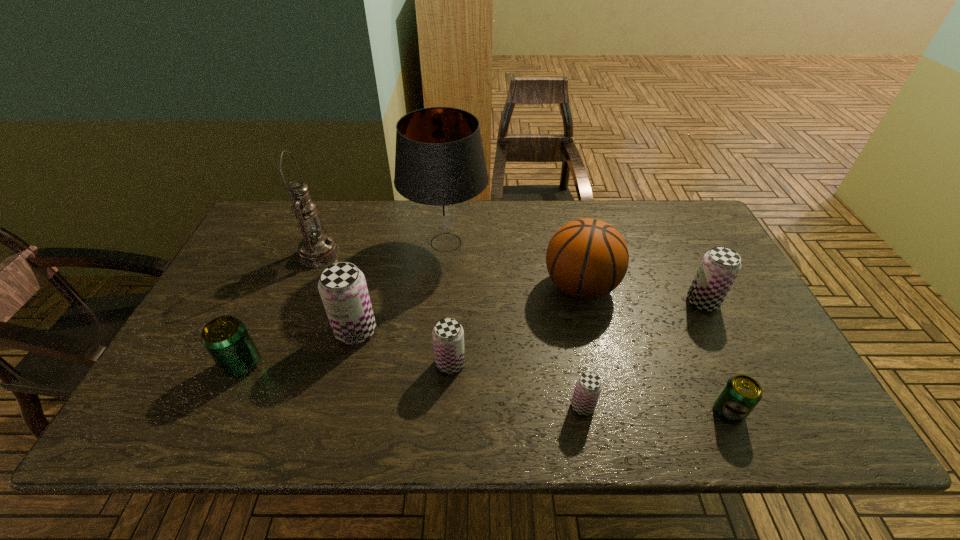
The width and height of the screenshot is (960, 540). What are the coordinates of `free space located on the right of the second purple beer can from left to right` in the screenshot? It's located at (604, 363).

This screenshot has width=960, height=540. In order to click on vacant region located on the right of the leftmost beer can in this screenshot , I will do `click(421, 364)`.

At what (x,y) coordinates should I click in order to perform the action: click on free space located on the left of the smallest purple beer can. Please return your answer as a coordinate pair (x, y). Image resolution: width=960 pixels, height=540 pixels. Looking at the image, I should click on (502, 406).

Locate an element on the screen. This screenshot has width=960, height=540. free space located on the back of the nearer green beer can is located at coordinates (690, 325).

Locate an element on the screen. lampshade that is at the far edge is located at coordinates (440, 168).

You are a GUI agent. You are given a task and a screenshot of the screen. Output one action in this format:
    pyautogui.click(x=<x>, y=<y>)
    Task: Click on the oil lamp that is at the far edge
    Image resolution: width=960 pixels, height=540 pixels.
    Given the screenshot: What is the action you would take?
    pyautogui.click(x=316, y=249)

This screenshot has height=540, width=960. What are the coordinates of `object at the left edge` in the screenshot? It's located at (226, 339).

In order to click on object located in the near right corner section of the desktop in this screenshot , I will do `click(741, 393)`.

The height and width of the screenshot is (540, 960). In the image, there is a desktop. Identify the location of vacant space at the far edge. (336, 235).

Where is `free space at the near edge of the desktop`? The height and width of the screenshot is (540, 960). free space at the near edge of the desktop is located at coordinates (659, 411).